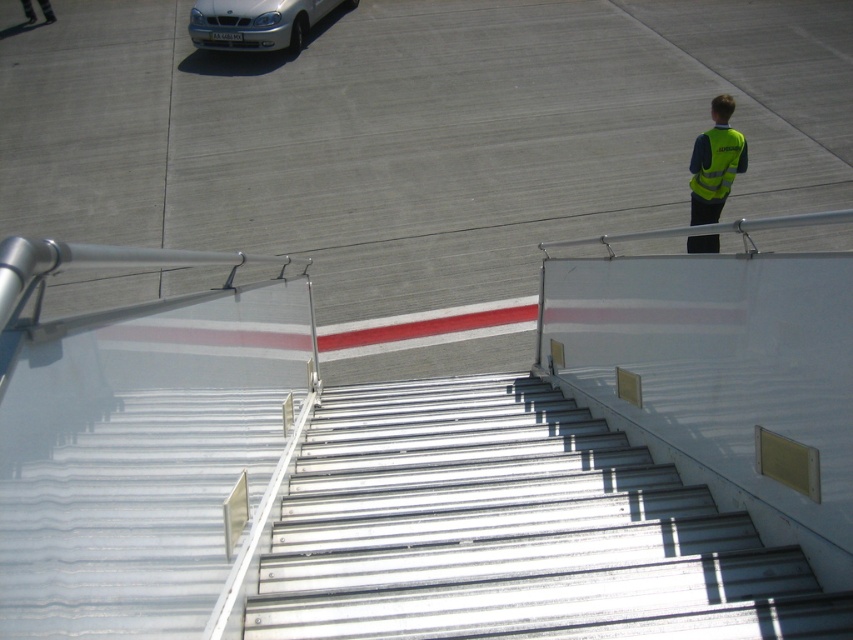
Question: Observing the image, what is the correct spatial positioning of white metallic stairs at center in reference to yellow reflective safety vest at upper right?

Choices:
 (A) right
 (B) left

Answer: (B)

Question: Does white metallic stairs at center have a larger size compared to yellow reflective safety vest at upper right?

Choices:
 (A) yes
 (B) no

Answer: (A)

Question: Which point appears closest to the camera in this image?

Choices:
 (A) (294, 497)
 (B) (703, 189)
 (C) (732, 177)
 (D) (264, 176)

Answer: (A)

Question: Among these objects, which one is nearest to the camera?

Choices:
 (A) yellow reflective vest at upper right
 (B) metallic silver stairs at center

Answer: (B)

Question: Is white metallic stairs at center positioned behind silver metallic car at upper left?

Choices:
 (A) no
 (B) yes

Answer: (A)

Question: Which point appears farthest from the camera in this image?

Choices:
 (A) 538,593
 (B) 721,138
 (C) 694,200

Answer: (C)